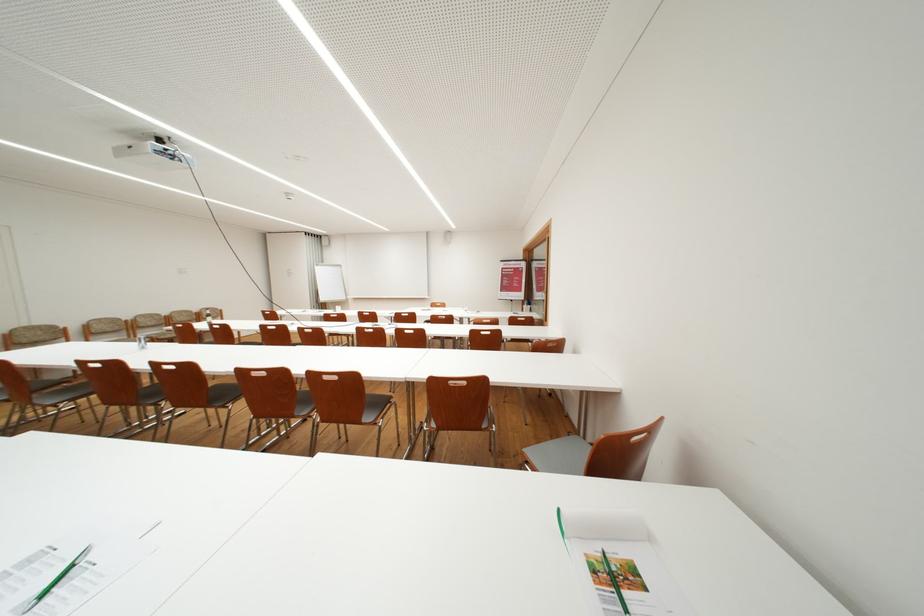
Where is `whiteboard on stand`? The height and width of the screenshot is (616, 924). whiteboard on stand is located at coordinates (330, 283).